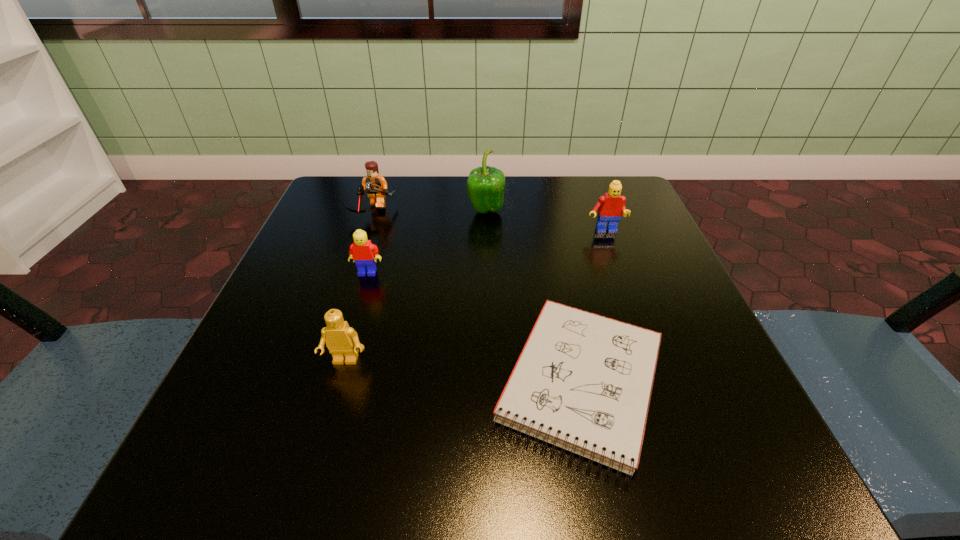
This screenshot has width=960, height=540. Identify the location of unoccupied area between the notepad and the farthest Lego. (477, 297).

I want to click on empty location between the farthest Lego and the second farthest Lego, so click(x=489, y=222).

Image resolution: width=960 pixels, height=540 pixels. What are the coordinates of `free space between the nearest Lego and the bell pepper` in the screenshot? It's located at (416, 286).

This screenshot has width=960, height=540. I want to click on free area in between the second farthest Lego and the third nearest object, so click(486, 252).

This screenshot has height=540, width=960. I want to click on free space that is in between the third nearest object and the third farthest object, so click(486, 252).

Where is `vacant area that lies between the fourth farthest object and the tallest object`? The height and width of the screenshot is (540, 960). vacant area that lies between the fourth farthest object and the tallest object is located at coordinates (426, 242).

You are a GUI agent. You are given a task and a screenshot of the screen. Output one action in this format:
    pyautogui.click(x=<x>, y=<y>)
    Task: Click on the free space that is in between the rightmost Lego and the bell pepper
    
    Given the screenshot: What is the action you would take?
    pyautogui.click(x=545, y=221)

Identify which object is the second nearest to the third farthest Lego. Please provide its 2D coordinates. Your answer should be formatted as a tuple, i.e. [(x, y)], where the tuple contains the x and y coordinates of a point satisfying the conditions above.

[(342, 341)]

Locate which object ranks third in proximity to the tallest object. Please provide its 2D coordinates. Your answer should be formatted as a tuple, i.e. [(x, y)], where the tuple contains the x and y coordinates of a point satisfying the conditions above.

[(362, 251)]

Select which Lego appears as the closest to the farthest Lego. Please provide its 2D coordinates. Your answer should be formatted as a tuple, i.e. [(x, y)], where the tuple contains the x and y coordinates of a point satisfying the conditions above.

[(362, 251)]